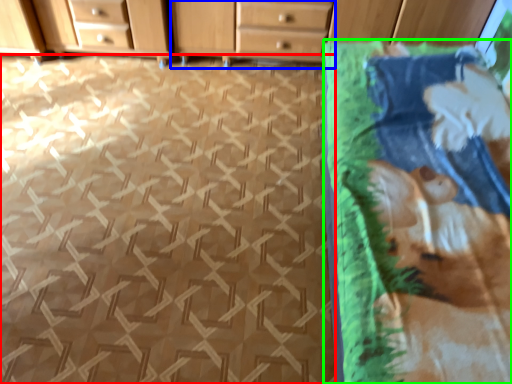
Question: Which object is positioned closest to tile (highlighted by a red box)? Select from chest of drawers (highlighted by a blue box) and blanket (highlighted by a green box).

Choices:
 (A) chest of drawers
 (B) blanket

Answer: (B)